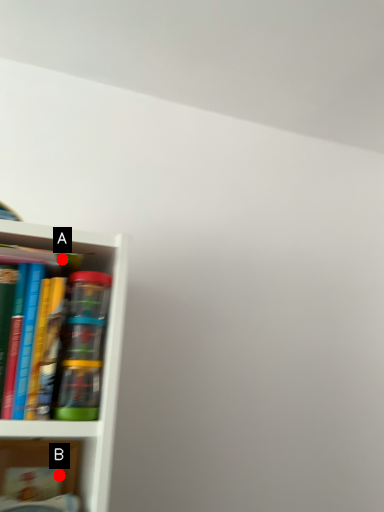
Question: Two points are circled on the image, labeled by A and B beside each circle. Which point is farther to the camera?

Choices:
 (A) A is further
 (B) B is further

Answer: (B)